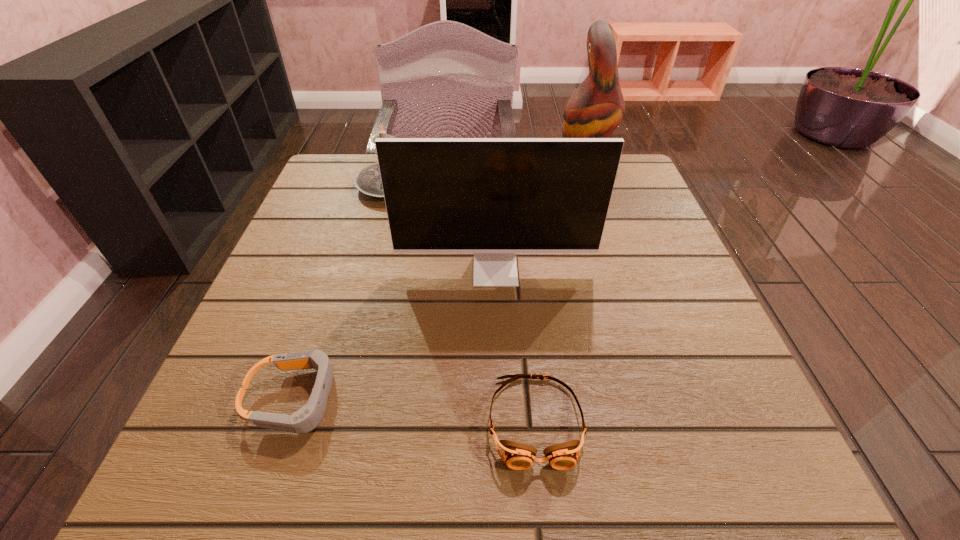
You are a GUI agent. You are given a task and a screenshot of the screen. Output one action in this format:
    pyautogui.click(x=<x>, y=<y>)
    Task: Click on the vacant space that satisfies the following two spatial constraints: 1. on the face of the parrot; 2. on the front-facing side of the monitor
    The width and height of the screenshot is (960, 540).
    Given the screenshot: What is the action you would take?
    pyautogui.click(x=620, y=271)